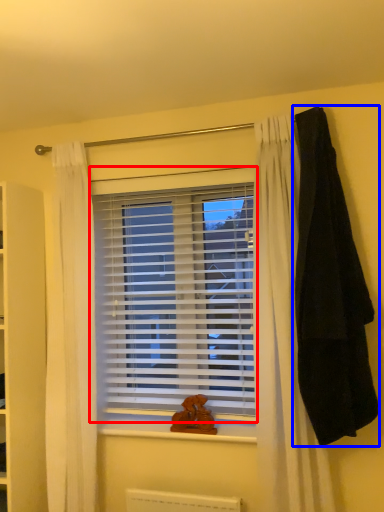
Question: Which object appears closest to the camera in this image, window blind (highlighted by a red box) or blanket (highlighted by a blue box)?

Choices:
 (A) window blind
 (B) blanket

Answer: (B)